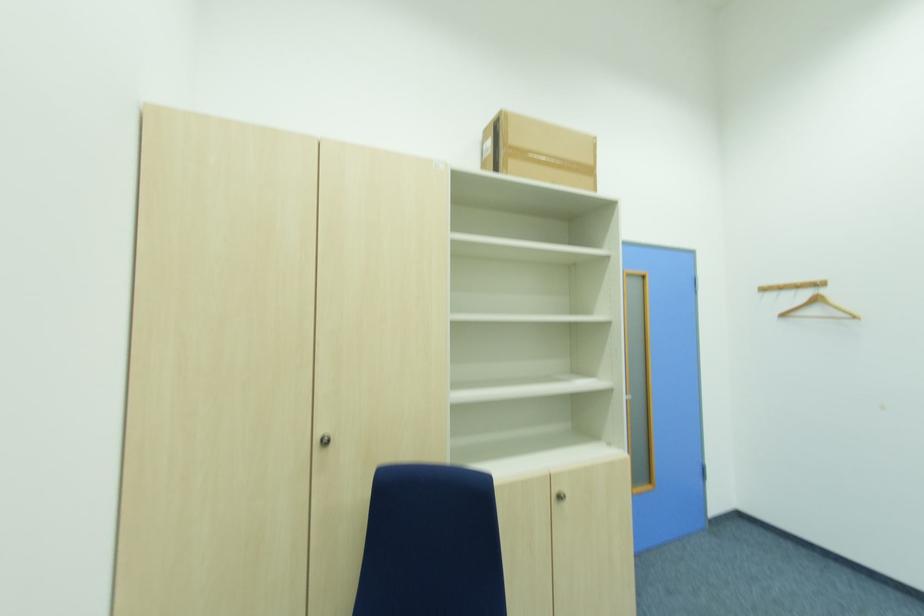
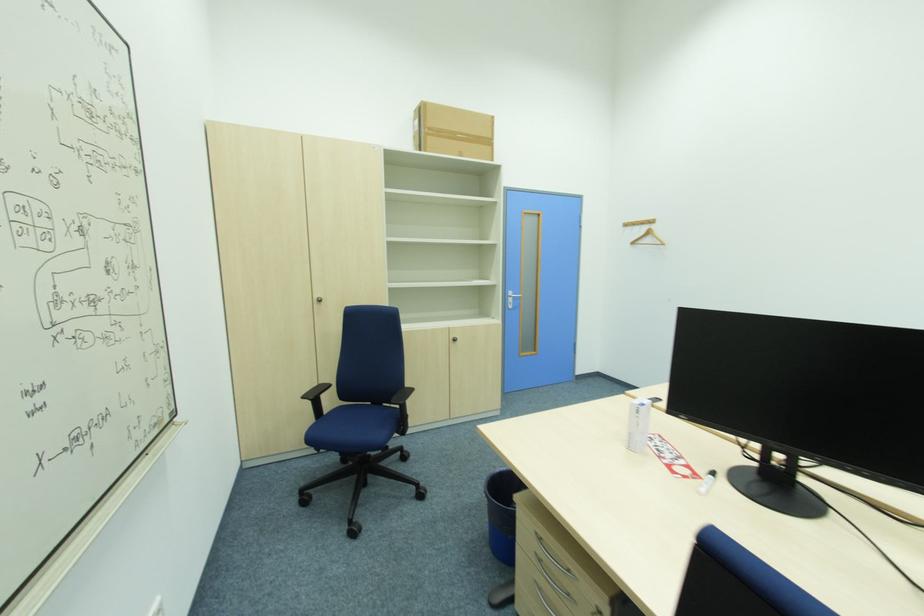
In a continuous first-person perspective shot, in which direction is the camera moving?

The cameraman moved toward right, backward.